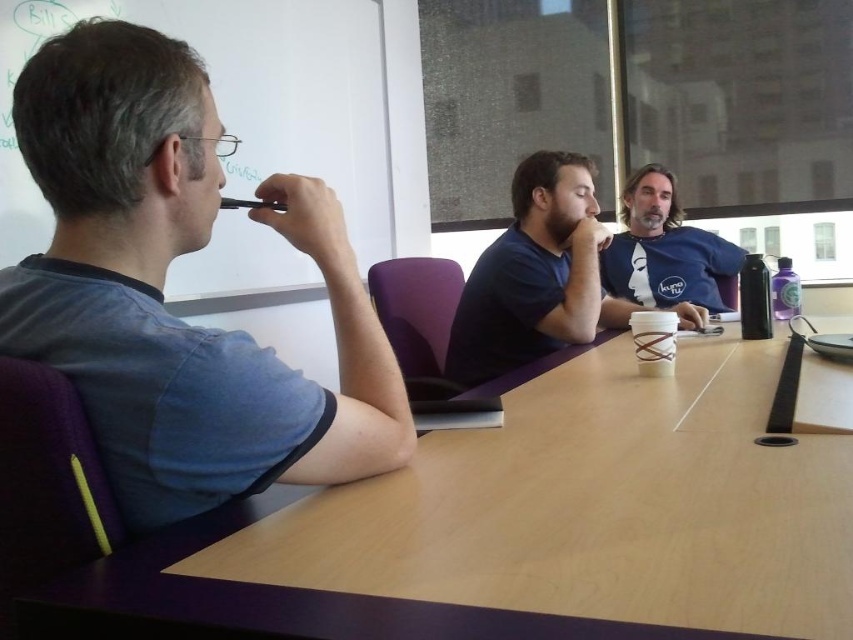
You are a photographer positioned behind the camera aiming to capture a clear shot of the matte blue shirt at center and the blue cotton shirt at upper center. Which shirt should you focus on first to ensure it appears sharp in the photo?

You should focus on the matte blue shirt at center first because it is closer to the camera and in front of the blue cotton shirt at upper center.

What are the coordinates of the light brown wood table at center?

The coordinates of the light brown wood table at center are at point (521, 529).